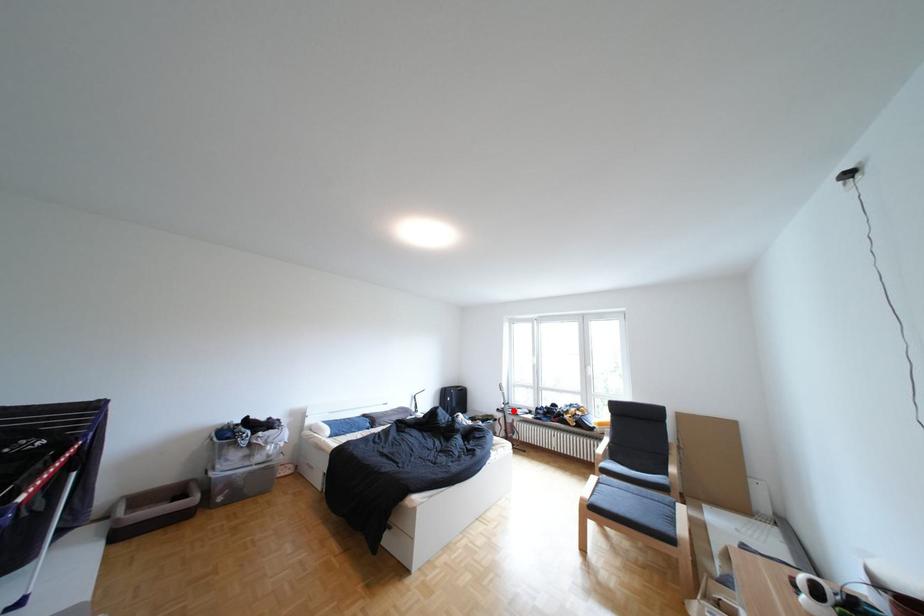
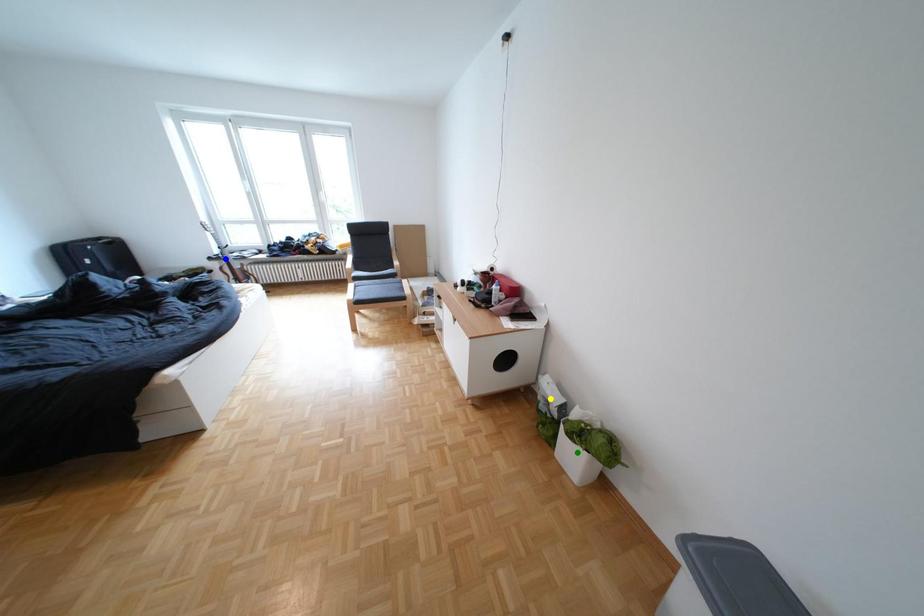
Question: I am providing you with two images of the same scene from different viewpoints. A red point is marked on the first image. You are given multiple points on the second image. Which spot in image 2 lines up with the point in image 1?

Choices:
 (A) yellow point
 (B) green point
 (C) blue point

Answer: (C)